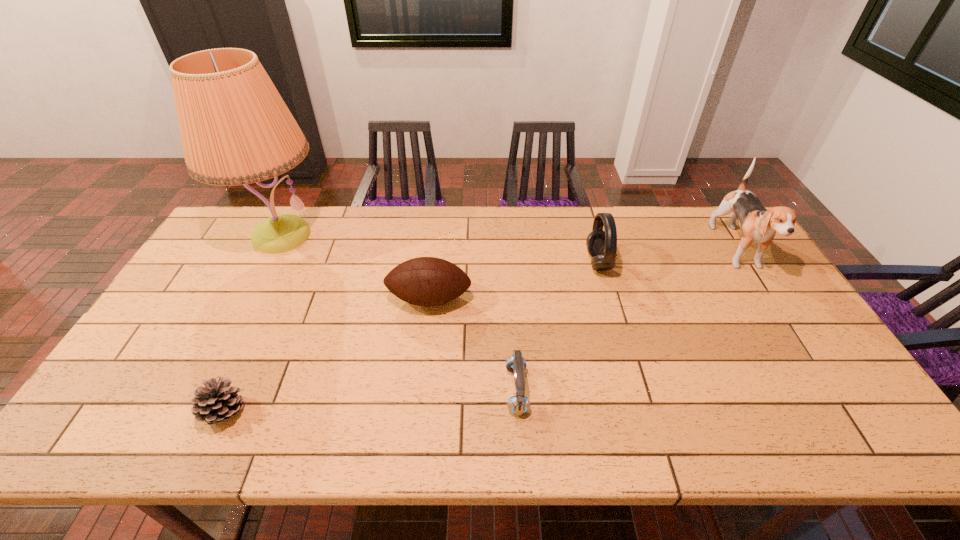
Locate an element on the screen. This screenshot has width=960, height=540. free space between the pinecone and the tallest object is located at coordinates (252, 324).

At what (x,y) coordinates should I click in order to perform the action: click on free space that is in between the fourth object from right to left and the left headset. Please return your answer as a coordinate pair (x, y). This screenshot has width=960, height=540. Looking at the image, I should click on [x=473, y=345].

The image size is (960, 540). Identify the location of free space between the football and the pinecone. (327, 356).

The height and width of the screenshot is (540, 960). In order to click on free space between the lamp and the nearer headset in this screenshot , I will do `click(399, 313)`.

Where is `free space between the fourth object from right to left and the tallest object`? free space between the fourth object from right to left and the tallest object is located at coordinates coord(355,267).

Choose which object is the third nearest neighbor to the puppy. Please provide its 2D coordinates. Your answer should be formatted as a tuple, i.e. [(x, y)], where the tuple contains the x and y coordinates of a point satisfying the conditions above.

[(424, 281)]

Select which object is the closest to the shorter headset. Please provide its 2D coordinates. Your answer should be formatted as a tuple, i.e. [(x, y)], where the tuple contains the x and y coordinates of a point satisfying the conditions above.

[(424, 281)]

Locate an element on the screen. vacant area that satisfies the following two spatial constraints: 1. on the earcups of the second object from right to left; 2. on the laces of the football is located at coordinates (609, 299).